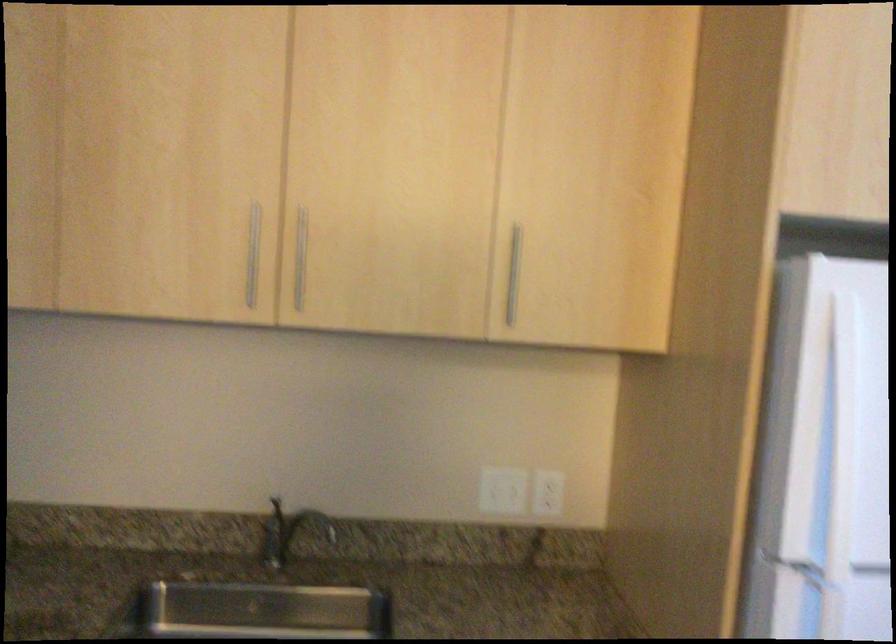
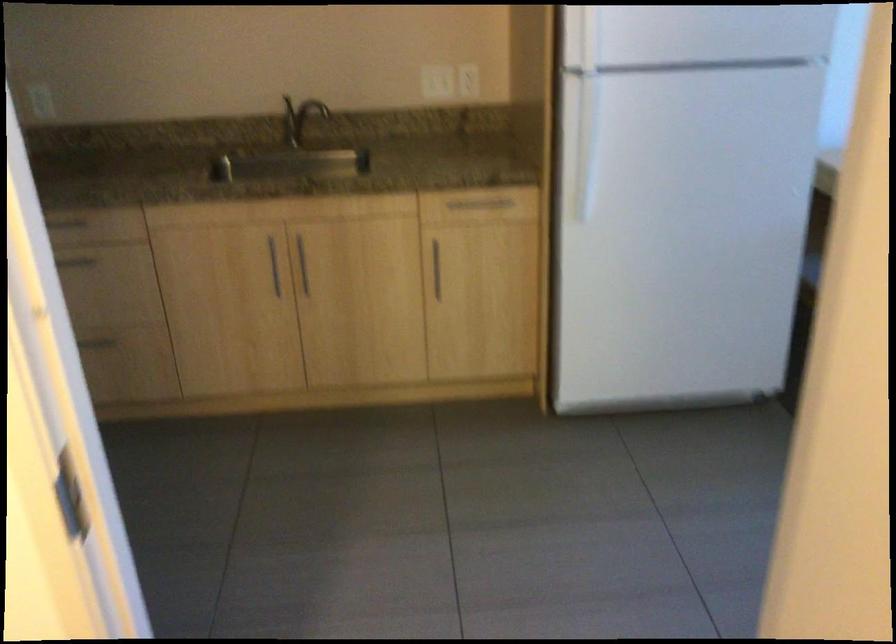
In the second image, find the point that corresponds to (x=294, y=522) in the first image.

(299, 118)